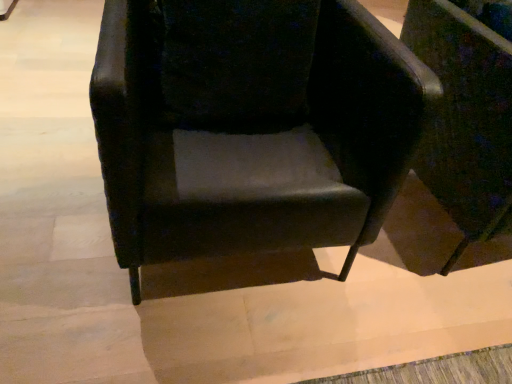
Locate an element on the screen. The image size is (512, 384). unoccupied area in front of velvet black armchair at center, marked as the 1th chair in a left-to-right arrangement is located at coordinates (185, 334).